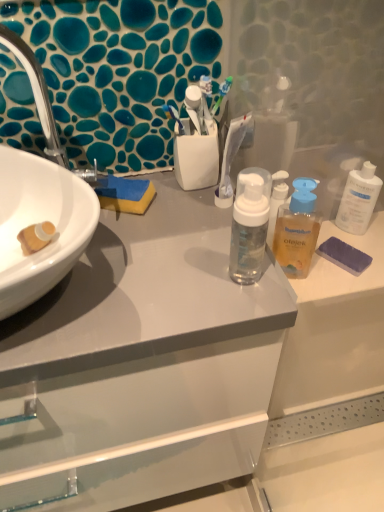
Identify the location of purple sponge at right. The height and width of the screenshot is (512, 384). (344, 255).

The image size is (384, 512). Describe the element at coordinates (297, 230) in the screenshot. I see `translucent plastic bottle at center` at that location.

I want to click on translucent plastic bottle at center, so click(297, 230).

The width and height of the screenshot is (384, 512). What do you see at coordinates (144, 362) in the screenshot?
I see `white glossy cabinet at center` at bounding box center [144, 362].

The width and height of the screenshot is (384, 512). I want to click on matte white sink at left, so click(37, 222).

Would you say matte white sink at left is part of white plastic bottle at upper right's contents?

No, matte white sink at left is not inside white plastic bottle at upper right.

Which is further, [376,195] or [11,250]?

The point [376,195] is more distant.

From a real-world perspective, who is located lower, white plastic bottle at upper right or matte white sink at left?

white plastic bottle at upper right is physically lower.

Where is `cleaning product located below the matte white sink at left (from the image's perspective)`? The width and height of the screenshot is (384, 512). cleaning product located below the matte white sink at left (from the image's perspective) is located at coordinates (359, 199).

Which object is positioned more to the left, purple sponge at right or matte white sink at left?

matte white sink at left.

From the image's perspective, which object appears higher, purple sponge at right or matte white sink at left?

matte white sink at left is shown above in the image.

Find the location of a particular element. This screenshot has height=512, width=384. sink in front of the purple sponge at right is located at coordinates pyautogui.click(x=37, y=222).

Can you confirm if white plastic bottle at upper right is shorter than white glossy cabinet at center?

Yes, white plastic bottle at upper right is shorter than white glossy cabinet at center.

Where is `cleaning product lying on the right of white glossy cabinet at center`? cleaning product lying on the right of white glossy cabinet at center is located at coordinates (359, 199).

Between white plastic bottle at upper right and white glossy cabinet at center, which one has smaller width?

Thinner between the two is white plastic bottle at upper right.

Between matte white sink at left and white glossy cabinet at center, which one has larger width?

With larger width is white glossy cabinet at center.

Which object is positioned more to the left, matte white sink at left or white glossy cabinet at center?

matte white sink at left.

Is matte white sink at left not near white glossy cabinet at center?

No, matte white sink at left is in close proximity to white glossy cabinet at center.

Which of these two, matte white sink at left or white glossy cabinet at center, is bigger?

white glossy cabinet at center.

Considering the positions of objects white glossy cabinet at center and white plastic bottle at upper right in the image provided, who is more to the left, white glossy cabinet at center or white plastic bottle at upper right?

white glossy cabinet at center.

Which is in front, point (69, 306) or point (357, 213)?

The point (69, 306) is more forward.

Which object is thinner, white glossy cabinet at center or white plastic bottle at upper right?

With smaller width is white plastic bottle at upper right.

Is white glossy cabinet at center not near white plastic bottle at upper right?

white glossy cabinet at center is actually quite close to white plastic bottle at upper right.

Considering the relative sizes of matte white sink at left and translucent plastic bottle at center in the image provided, is matte white sink at left thinner than translucent plastic bottle at center?

Incorrect, the width of matte white sink at left is not less than that of translucent plastic bottle at center.

Is point (1, 261) closer to viewer compared to point (296, 206)?

That is True.

Who is more distant, matte white sink at left or translucent plastic bottle at center?

translucent plastic bottle at center is behind.

Does point (381, 181) appear closer or farther from the camera than point (360, 268)?

Point (381, 181).

How distant is white plastic bottle at upper right from purple sponge at right?

white plastic bottle at upper right is 17.39 centimeters from purple sponge at right.

Between white plastic bottle at upper right and purple sponge at right, which one has smaller width?

white plastic bottle at upper right is thinner.

From a real-world perspective, who is located lower, white plastic bottle at upper right or purple sponge at right?

purple sponge at right, from a real-world perspective.

In the image, there is a white plastic bottle at upper right. Find the location of `sink above it (from the image's perspective)`. sink above it (from the image's perspective) is located at coordinates (37, 222).

Find the location of a particular element. soap behind the matte white sink at left is located at coordinates (344, 255).

Considering their positions, is purple sponge at right positioned further to white plastic bottle at upper right than matte white sink at left?

matte white sink at left is further to white plastic bottle at upper right.

When comparing their distances from purple sponge at right, does translucent plastic bottle at center or white plastic bottle at upper right seem further?

white plastic bottle at upper right is positioned further to the anchor purple sponge at right.

Based on their spatial positions, is translucent plastic bottle at center or matte white sink at left closer to white plastic bottle at upper right?

translucent plastic bottle at center is closer to white plastic bottle at upper right.

Considering their positions, is white glossy cabinet at center positioned further to translucent plastic bottle at center than matte white sink at left?

matte white sink at left.

When comparing their distances from purple sponge at right, does matte white sink at left or translucent plastic bottle at center seem closer?

translucent plastic bottle at center is closer to purple sponge at right.

When comparing their distances from purple sponge at right, does translucent plastic bottle at center or white glossy cabinet at center seem closer?

translucent plastic bottle at center lies closer to purple sponge at right than the other object.

When comparing their distances from matte white sink at left, does white plastic bottle at upper right or translucent plastic bottle at center seem further?

white plastic bottle at upper right.

Which object lies nearer to the anchor point translucent plastic bottle at center, white plastic bottle at upper right or matte white sink at left?

white plastic bottle at upper right is positioned closer to the anchor translucent plastic bottle at center.

The height and width of the screenshot is (512, 384). Identify the location of mouthwash between matte white sink at left and purple sponge at right from left to right. (297, 230).

The width and height of the screenshot is (384, 512). What are the coordinates of `soap between matte white sink at left and white plastic bottle at upper right` in the screenshot? It's located at (344, 255).

Where is `soap situated between white glossy cabinet at center and white plastic bottle at upper right from left to right`? The height and width of the screenshot is (512, 384). soap situated between white glossy cabinet at center and white plastic bottle at upper right from left to right is located at coordinates (344, 255).

Locate an element on the screen. Image resolution: width=384 pixels, height=512 pixels. bathroom cabinet between matte white sink at left and white plastic bottle at upper right in the horizontal direction is located at coordinates (144, 362).